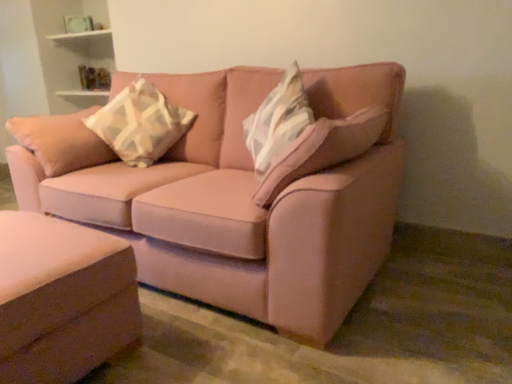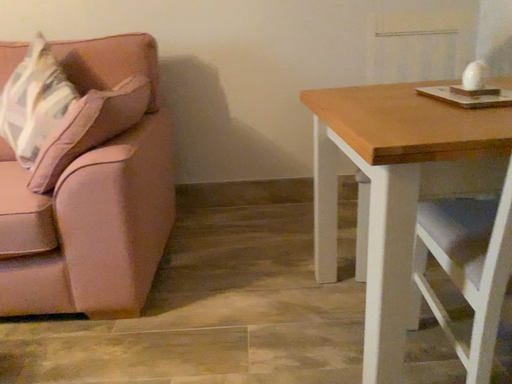
Question: How did the camera likely rotate when shooting the video?

Choices:
 (A) rotated right
 (B) rotated left

Answer: (A)